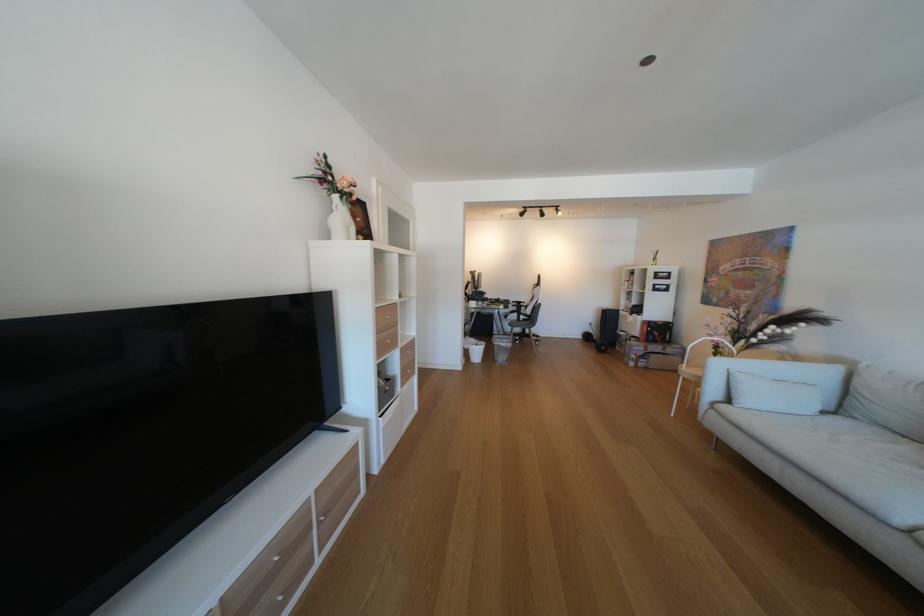
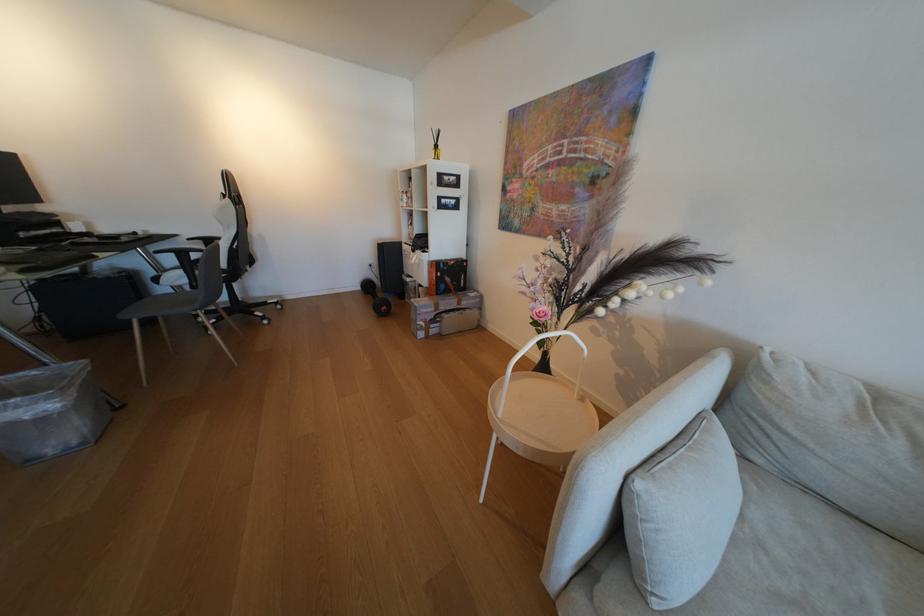
Locate, in the second image, the point that corresponds to (747,406) in the first image.

(665, 604)